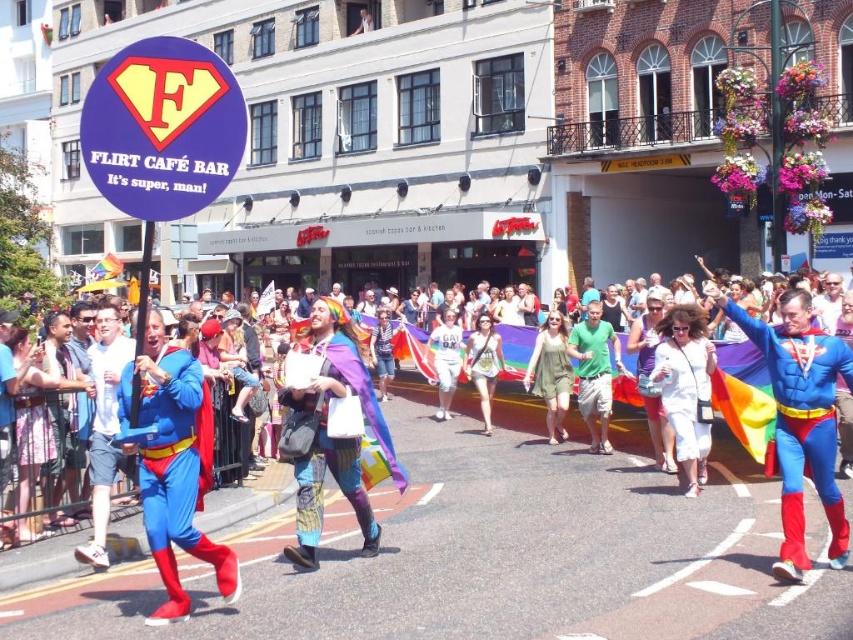
You are a photographer trying to capture a group photo of the blue fabric superman costume at left and the white matte dress at center. If you want both subjects to be fully visible in the frame without cropping, which subject should you position closer to the camera?

The blue fabric superman costume at left might be wider than the white matte dress at center, so positioning the blue fabric superman costume at left closer to the camera would allow both subjects to fit within the frame without cropping.

You are a fashion designer observing the vibrant street scene. You notice the green fabric bag at center and the matte white tank top at center. Which item takes up more space in the scene?

The matte white tank top at center takes up more space than the green fabric bag at center.